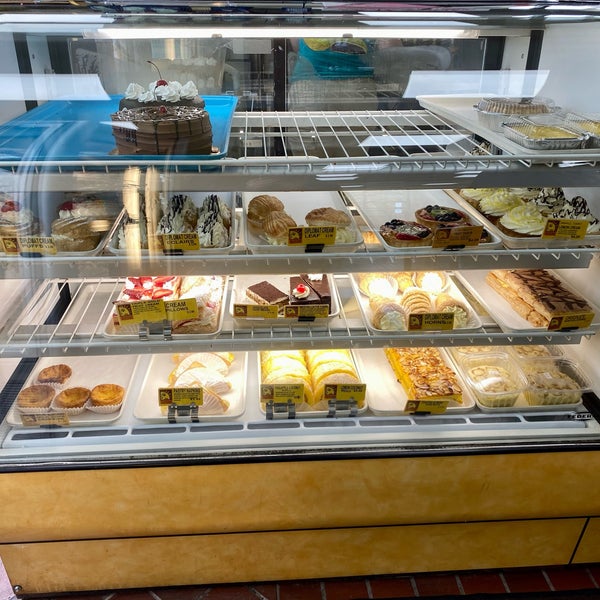
The width and height of the screenshot is (600, 600). I want to click on glass door in back, so click(x=60, y=58), click(x=358, y=62).